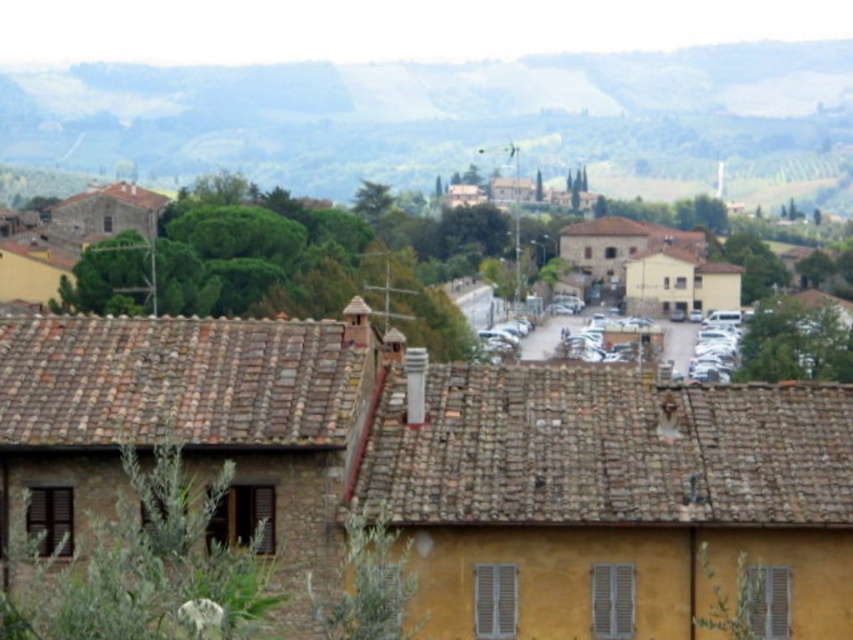
From the picture: Between brown stone building at center and green grassy hillside at upper center, which one appears on the left side from the viewer's perspective?

Positioned to the left is brown stone building at center.

Which is more to the right, brown stone building at center or green grassy hillside at upper center?

green grassy hillside at upper center

What do you see at coordinates (450, 465) in the screenshot?
I see `brown stone building at center` at bounding box center [450, 465].

Where is `brown stone building at center`? brown stone building at center is located at coordinates (450, 465).